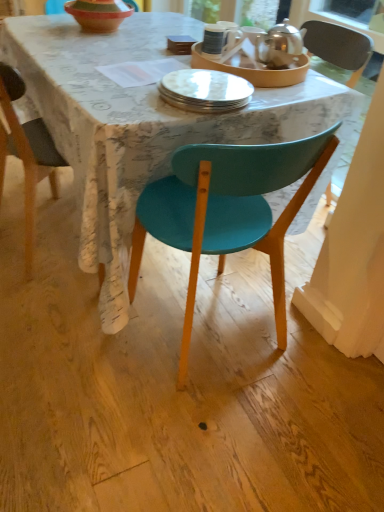
Where is `free space that is to the left of terracotta clay bowl at upper center`? Image resolution: width=384 pixels, height=512 pixels. free space that is to the left of terracotta clay bowl at upper center is located at coordinates (37, 25).